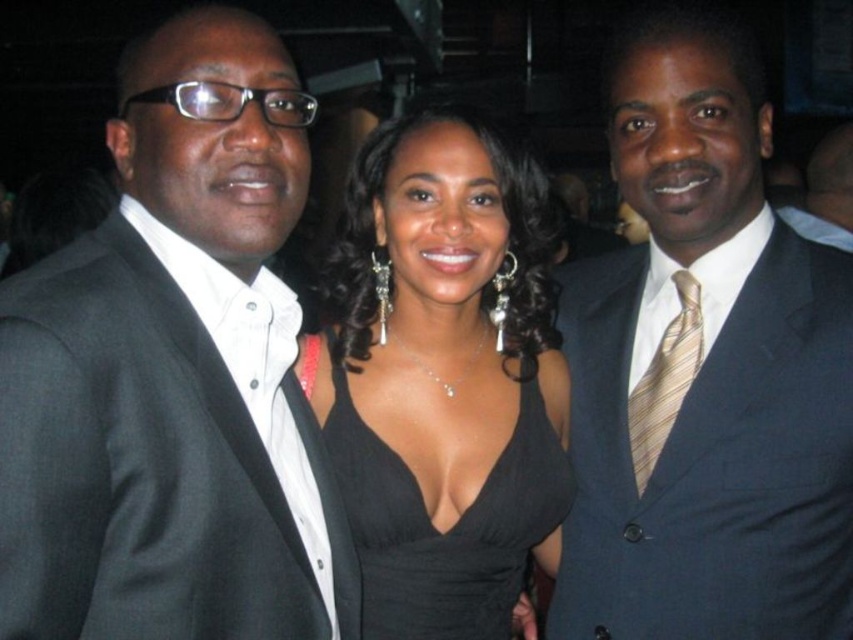
You are a photographer at a formal event. You need to adjust the lighting to ensure both the black suit at left and the black satin dress at center are well illuminated. Based on their positions, which object is higher up and requires more upward lighting adjustment?

The black suit at left is located above the black satin dress at center, so it requires more upward lighting adjustment to ensure proper illumination.

Looking at this image, you are at a formal event and need to find the black suit at left and shiny navy suit at center. Based on the scene description, which one is positioned to the left of the other?

The black suit at left is positioned to the left of the shiny navy suit at center.

In the scene shown: You are a photographer adjusting your camera settings to focus on the shiny navy suit at center and the black satin dress at center. Which object should you focus on first to ensure proper depth of field?

The shiny navy suit at center is closer to the viewer than the black satin dress at center, so you should focus on the shiny navy suit at center first to ensure proper depth of field.